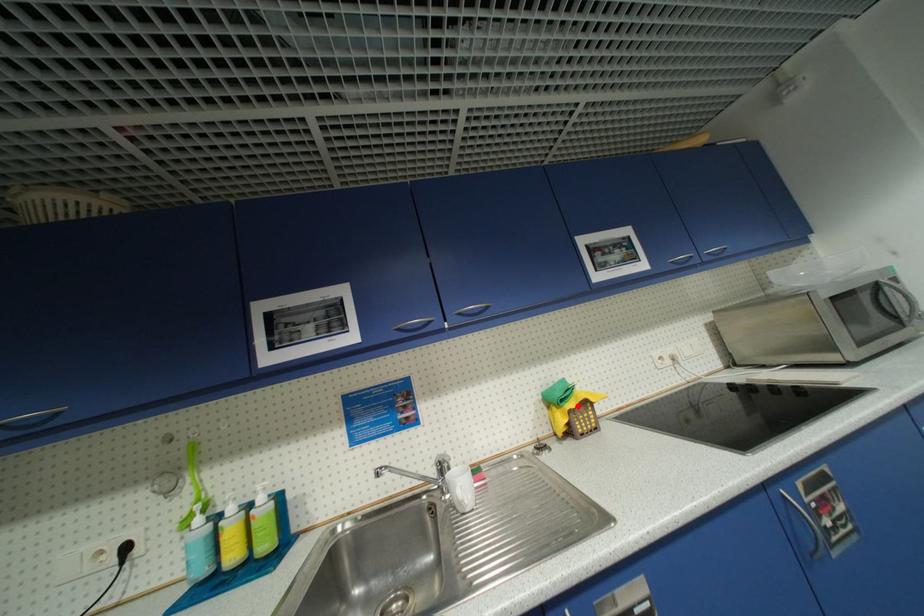
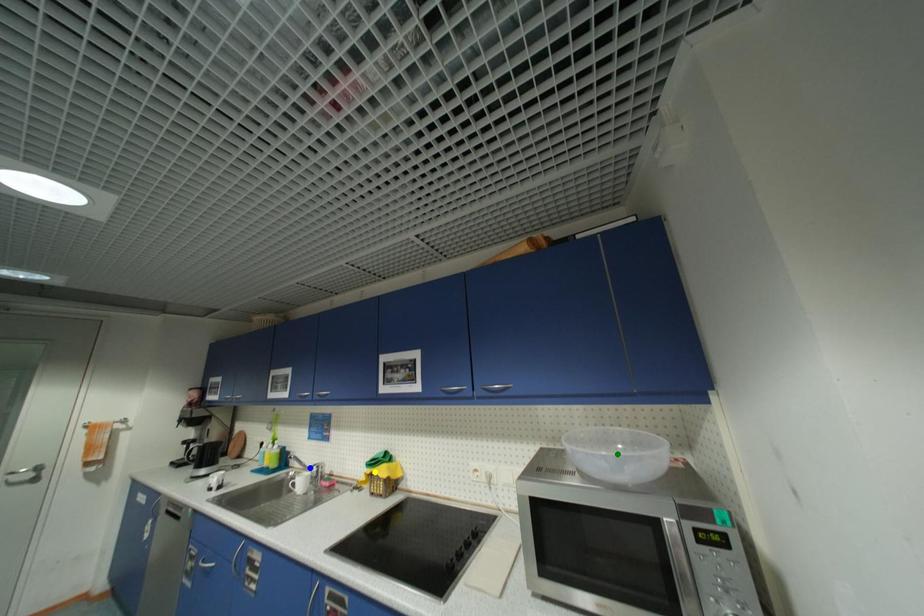
Question: I am providing you with two images of the same scene from different viewpoints. A red point is marked on the first image. You are given multiple points on the second image. Which spot in image 2 lines up with the point in image 1?

Choices:
 (A) green point
 (B) blue point
 (C) yellow point

Answer: (C)